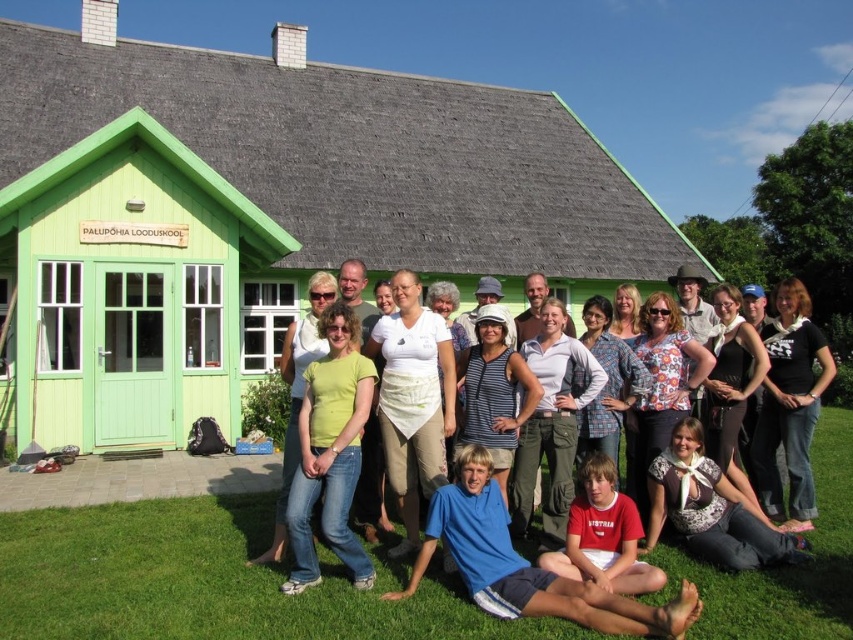
In the scene shown: Please describe the position of the green grass at lower center in terms of its coordinates within the image frame. Use the coordinate system where the bottom left corner is the origin point.

The green grass at lower center is located at coordinates approximately 0.909 along the x axis and 0.245 along the y axis within the image frame.

You are standing in front of the building and notice the green wooden hut at center and the red cotton shirt at lower center. Which object is closer to you?

The red cotton shirt at lower center is closer to you because the green wooden hut at center is positioned over it, indicating it is further away.

You are standing at the center of the image and want to locate the green wooden hut at center. What are the coordinates where you should look?

The green wooden hut at center is located at coordinates point (x=260, y=214).